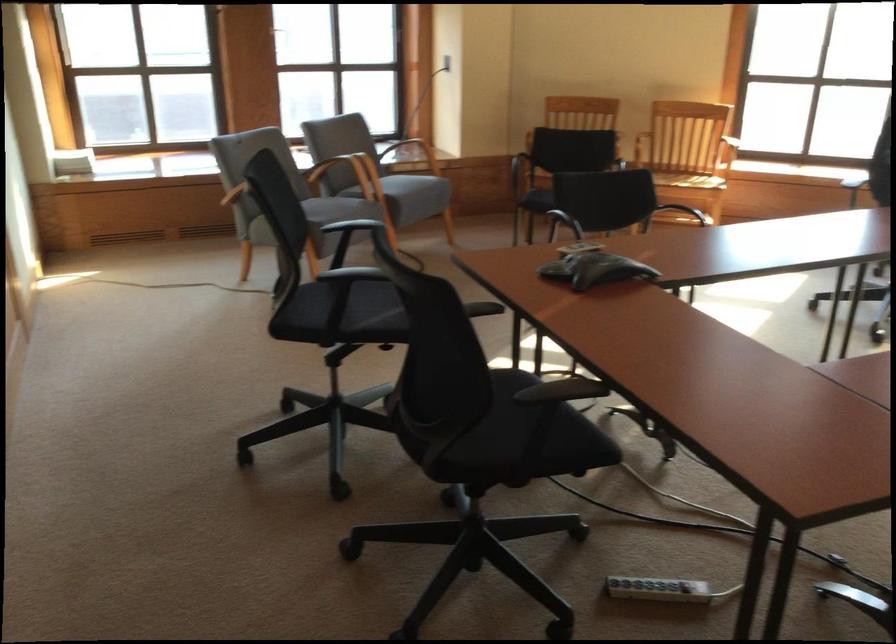
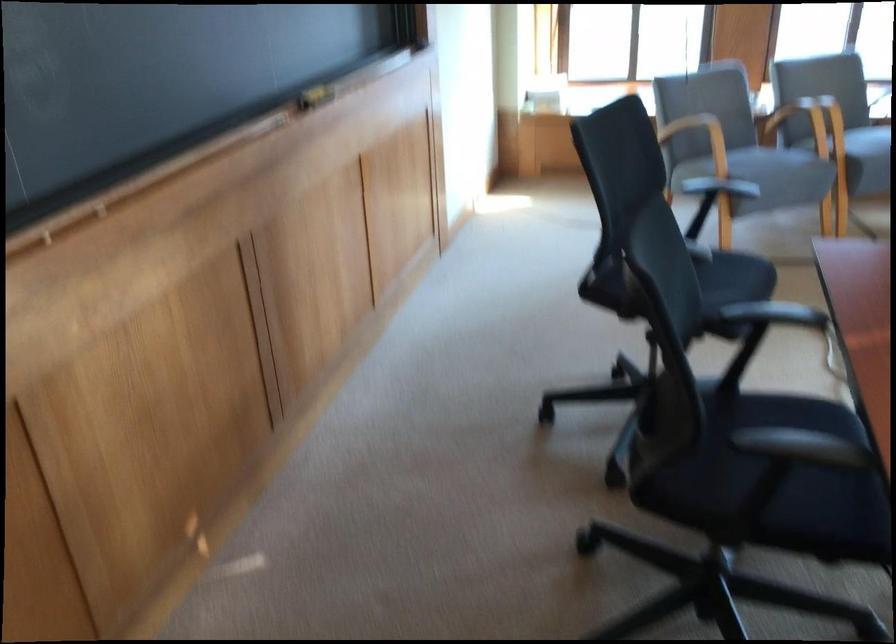
Question: I am providing you with two images of the same scene from different viewpoints. Please identify which objects are invisible in image2.

Choices:
 (A) wooden chair armrest
 (B) black chair sitting surface
 (C) metal dispenser lever
 (D) yellow board eraser

Answer: (B)